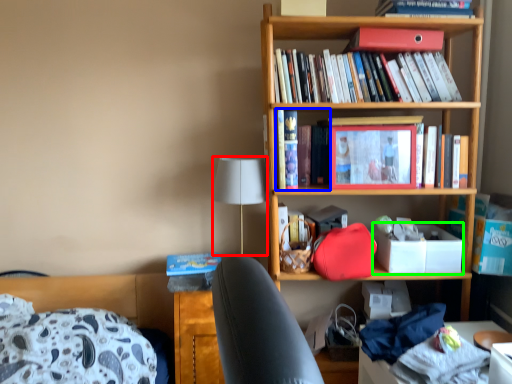
Question: Based on their relative distances, which object is farther from lamp (highlighted by a red box)? Choose from book (highlighted by a blue box) and box (highlighted by a green box).

Choices:
 (A) book
 (B) box

Answer: (B)